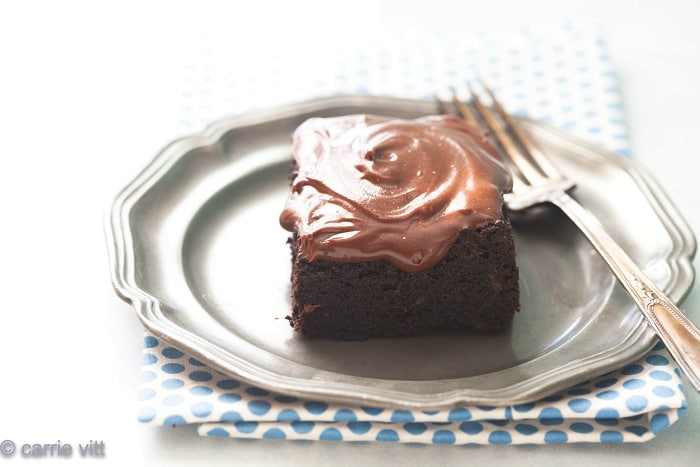
Where is `white counter`? This screenshot has height=467, width=700. white counter is located at coordinates (519, 455).